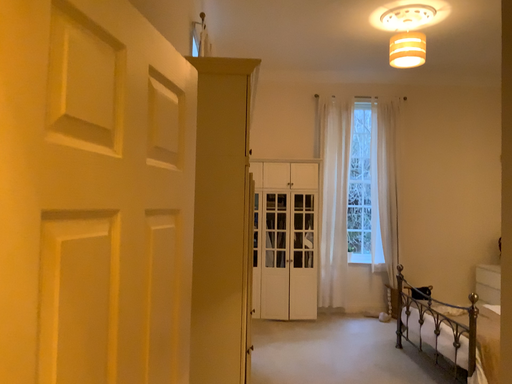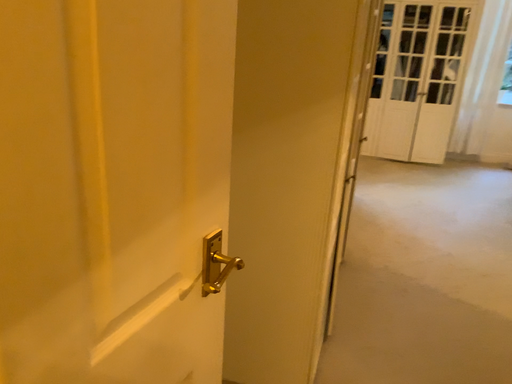
Question: How did the camera likely rotate when shooting the video?

Choices:
 (A) rotated left
 (B) rotated right

Answer: (A)